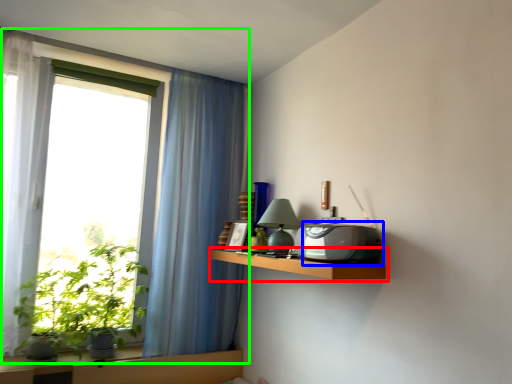
Question: Which object is the closest to the shelf (highlighted by a red box)? Choose among these: appliance (highlighted by a blue box) or window (highlighted by a green box).

Choices:
 (A) appliance
 (B) window

Answer: (A)